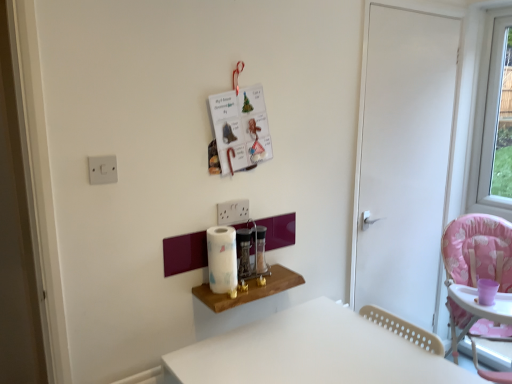
This screenshot has width=512, height=384. Find the location of `white matte table at lower center, which ranks as the second table in top-to-bottom order`. white matte table at lower center, which ranks as the second table in top-to-bottom order is located at coordinates (311, 352).

What is the approximate height of translucent glass spice jar at center, positioned as the 1th appliance in right-to-left order?

translucent glass spice jar at center, positioned as the 1th appliance in right-to-left order, is 8.10 inches in height.

The image size is (512, 384). What do you see at coordinates (478, 251) in the screenshot?
I see `pink fabric highchair at right` at bounding box center [478, 251].

In order to face pink fabric highchair at right, should I rotate leftwards or rightwards?

Turn right by 28.820 degrees to look at pink fabric highchair at right.

What is the approximate height of transparent glass window at upper right?

The height of transparent glass window at upper right is 3.85 feet.

What are the coordinates of `transparent glass window at upper right` in the screenshot? It's located at (488, 118).

Identify the location of white matte door at right. (404, 159).

Could you tell me if white matte door at right is facing white matte table at lower center, which ranks as the second table in top-to-bottom order?

No, white matte door at right is not turned towards white matte table at lower center, which ranks as the second table in top-to-bottom order.

Which point is more forward, (403, 23) or (401, 348)?

Positioned in front is point (401, 348).

In the scene shown: Is the position of white matte door at right more distant than that of white matte table at lower center, which ranks as the second table in top-to-bottom order?

Yes, it is.

Is white matte door at right beside white matte table at lower center, which ranks as the second table in top-to-bottom order?

No, white matte door at right is not next to white matte table at lower center, which ranks as the second table in top-to-bottom order.

Looking at this image, is metallic glass spice jar at center, the 2th appliance from the right, next to pink fabric highchair at right and touching it?

metallic glass spice jar at center, the 2th appliance from the right, and pink fabric highchair at right are not in contact.

Considering the relative sizes of metallic glass spice jar at center, arranged as the first appliance when viewed from the left, and pink fabric highchair at right in the image provided, is metallic glass spice jar at center, arranged as the first appliance when viewed from the left, taller than pink fabric highchair at right?

In fact, metallic glass spice jar at center, arranged as the first appliance when viewed from the left, may be shorter than pink fabric highchair at right.

Considering their positions, is metallic glass spice jar at center, the 2th appliance from the right, located in front of or behind pink fabric highchair at right?

metallic glass spice jar at center, the 2th appliance from the right, is positioned farther from the viewer than pink fabric highchair at right.

Which object is positioned more to the right, metallic glass spice jar at center, arranged as the first appliance when viewed from the left, or pink fabric highchair at right?

pink fabric highchair at right.

Looking at this image, based on their sizes in the image, would you say white matte table at lower center, the first table in the bottom-to-top sequence, is bigger or smaller than white plastic electric outlet at upper left?

Clearly, white matte table at lower center, the first table in the bottom-to-top sequence, is larger in size than white plastic electric outlet at upper left.

Could you tell me if white matte table at lower center, which appears as the first table when viewed from the right, is facing white plastic electric outlet at upper left?

No, white matte table at lower center, which appears as the first table when viewed from the right, is not turned towards white plastic electric outlet at upper left.

Can you tell me how much white matte table at lower center, which ranks as the second table in top-to-bottom order, and white plastic electric outlet at upper left differ in facing direction?

white matte table at lower center, which ranks as the second table in top-to-bottom order, and white plastic electric outlet at upper left are facing 90 degrees away from each other.

Which is behind, point (318, 365) or point (101, 156)?

Positioned behind is point (318, 365).

Which is more to the left, translucent glass spice jar at center, positioned as the 1th appliance in right-to-left order, or white plastic electric outlet at upper left?

white plastic electric outlet at upper left is more to the left.

You are a GUI agent. You are given a task and a screenshot of the screen. Output one action in this format:
    pyautogui.click(x=<x>, y=<y>)
    Task: Click on the appliance that is the 2nd object directly below the white plastic electric outlet at upper left (from a real-world perspective)
    
    Given the screenshot: What is the action you would take?
    pyautogui.click(x=260, y=252)

Is the depth of translucent glass spice jar at center, positioned as the 1th appliance in right-to-left order, less than that of white plastic electric outlet at upper left?

No, translucent glass spice jar at center, positioned as the 1th appliance in right-to-left order, is further to the viewer.

Is translucent glass spice jar at center, positioned as the 2th appliance in left-to-right order, facing towards white plastic electric outlet at upper left?

No, translucent glass spice jar at center, positioned as the 2th appliance in left-to-right order, does not turn towards white plastic electric outlet at upper left.

Is the surface of wooden shelf at center, which is the 2th table from right to left, in direct contact with metallic glass spice jar at center, the 2th appliance from the right?

No, wooden shelf at center, which is the 2th table from right to left, is not making contact with metallic glass spice jar at center, the 2th appliance from the right.

Looking at this image, how different are the orientations of wooden shelf at center, which is the 2th table from bottom to top, and metallic glass spice jar at center, the 2th appliance from the right, in degrees?

wooden shelf at center, which is the 2th table from bottom to top, and metallic glass spice jar at center, the 2th appliance from the right, are facing 0.518 degrees away from each other.

From a real-world perspective, is wooden shelf at center, marked as the first table in a left-to-right arrangement, physically below metallic glass spice jar at center, arranged as the first appliance when viewed from the left?

Yes, from a real-world perspective, wooden shelf at center, marked as the first table in a left-to-right arrangement, is beneath metallic glass spice jar at center, arranged as the first appliance when viewed from the left.

How distant is wooden shelf at center, which is the 2th table from right to left, from metallic glass spice jar at center, arranged as the first appliance when viewed from the left?

wooden shelf at center, which is the 2th table from right to left, and metallic glass spice jar at center, arranged as the first appliance when viewed from the left, are 5.76 inches apart.

Is white matte door at right placed right next to translucent glass spice jar at center, positioned as the 2th appliance in left-to-right order?

white matte door at right and translucent glass spice jar at center, positioned as the 2th appliance in left-to-right order, are not in contact.

You are a GUI agent. You are given a task and a screenshot of the screen. Output one action in this format:
    pyautogui.click(x=<x>, y=<y>)
    Task: Click on the door that appears above the translucent glass spice jar at center, positioned as the 1th appliance in right-to-left order (from the image's perspective)
    The image size is (512, 384).
    Given the screenshot: What is the action you would take?
    [404, 159]

Is white matte door at right situated inside translucent glass spice jar at center, positioned as the 1th appliance in right-to-left order, or outside?

white matte door at right is not inside translucent glass spice jar at center, positioned as the 1th appliance in right-to-left order, it's outside.

Considering the positions of objects white matte door at right and translucent glass spice jar at center, positioned as the 2th appliance in left-to-right order, in the image provided, who is more to the left, white matte door at right or translucent glass spice jar at center, positioned as the 2th appliance in left-to-right order,?

translucent glass spice jar at center, positioned as the 2th appliance in left-to-right order, is more to the left.

At what (x,y) coordinates should I click in order to perform the action: click on window located above the pink fabric highchair at right (from a real-world perspective). Please return your answer as a coordinate pair (x, y). This screenshot has height=384, width=512. Looking at the image, I should click on (488, 118).

Could you tell me if transparent glass window at upper right is facing pink fabric highchair at right?

No, transparent glass window at upper right is not facing towards pink fabric highchair at right.

Can you confirm if transparent glass window at upper right is taller than pink fabric highchair at right?

Yes, transparent glass window at upper right is taller than pink fabric highchair at right.

What are the coordinates of `table that is the 1st object to the left of the white matte door at right, starting at the anchor` in the screenshot? It's located at (311, 352).

The height and width of the screenshot is (384, 512). Find the location of `chair lying in front of the metallic glass spice jar at center, arranged as the first appliance when viewed from the left`. chair lying in front of the metallic glass spice jar at center, arranged as the first appliance when viewed from the left is located at coordinates (478, 251).

Based on the photo, looking at the image, which one is located further to white matte door at right, wooden shelf at center, the 1th table positioned from the top, or transparent glass window at upper right?

Among the two, wooden shelf at center, the 1th table positioned from the top, is located further to white matte door at right.

Considering their positions, is wooden shelf at center, the 1th table positioned from the top, positioned closer to translucent glass spice jar at center, positioned as the 2th appliance in left-to-right order, than white matte table at lower center, which ranks as the second table in top-to-bottom order?

wooden shelf at center, the 1th table positioned from the top.

Which object lies further to the anchor point white matte table at lower center, which appears as the first table when viewed from the right, transparent glass window at upper right or pink fabric highchair at right?

transparent glass window at upper right lies further to white matte table at lower center, which appears as the first table when viewed from the right, than the other object.

When comparing their distances from white matte door at right, does white plastic electric outlet at upper left or metallic glass spice jar at center, the 2th appliance from the right, seem further?

Among the two, white plastic electric outlet at upper left is located further to white matte door at right.

When comparing their distances from transparent glass window at upper right, does metallic glass spice jar at center, arranged as the first appliance when viewed from the left, or white plastic electric outlet at upper left seem closer?

metallic glass spice jar at center, arranged as the first appliance when viewed from the left, lies closer to transparent glass window at upper right than the other object.

Considering their positions, is wooden shelf at center, which is the 2th table from bottom to top, positioned further to white plastic electric outlet at upper left than white matte table at lower center, the first table in the bottom-to-top sequence?

Based on the image, white matte table at lower center, the first table in the bottom-to-top sequence, appears to be further to white plastic electric outlet at upper left.

Considering their positions, is wooden shelf at center, which is the 2th table from right to left, positioned closer to transparent glass window at upper right than white matte table at lower center, the first table in the bottom-to-top sequence?

wooden shelf at center, which is the 2th table from right to left, lies closer to transparent glass window at upper right than the other object.

From the image, which object appears to be nearer to transparent glass window at upper right, translucent glass spice jar at center, positioned as the 1th appliance in right-to-left order, or pink fabric highchair at right?

pink fabric highchair at right is positioned closer to the anchor transparent glass window at upper right.

This screenshot has width=512, height=384. I want to click on chair between translucent glass spice jar at center, positioned as the 2th appliance in left-to-right order, and transparent glass window at upper right from left to right, so click(478, 251).

What are the coordinates of `door between transparent glass window at upper right and pink fabric highchair at right in the vertical direction` in the screenshot? It's located at click(x=404, y=159).

Identify the location of chair between wooden shelf at center, the 1th table positioned from the top, and transparent glass window at upper right. (478, 251).

Image resolution: width=512 pixels, height=384 pixels. Find the location of `table situated between wooden shelf at center, which is the 2th table from right to left, and white matte door at right from left to right`. table situated between wooden shelf at center, which is the 2th table from right to left, and white matte door at right from left to right is located at coordinates (311, 352).